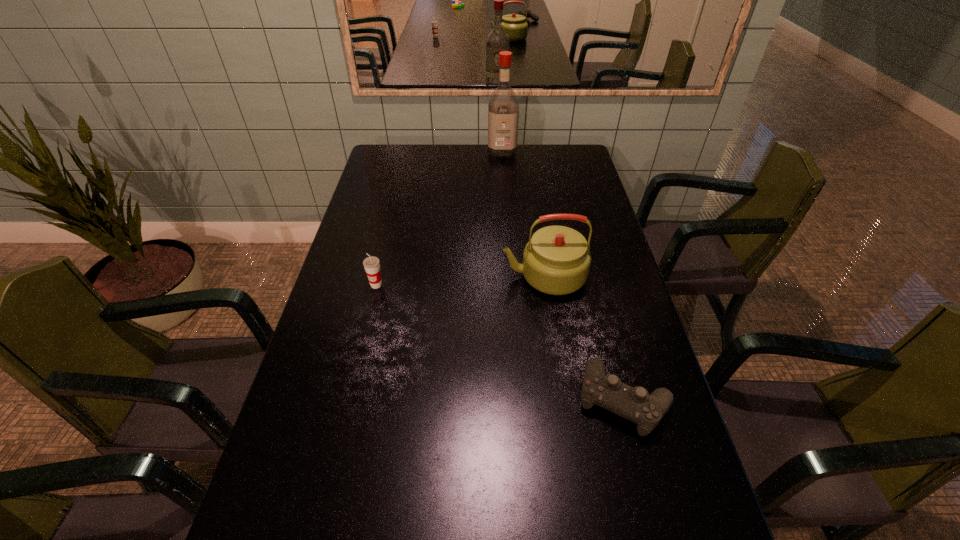
Identify the location of vacant space located 0.110m at the spout of the third shortest object. Image resolution: width=960 pixels, height=540 pixels. (467, 276).

This screenshot has height=540, width=960. Identify the location of vacant space located 0.270m on the side of the second shortest object with the logo. (357, 367).

This screenshot has height=540, width=960. Identify the location of free space located 0.180m on the left of the nearest object. (502, 400).

Find the location of `object that is at the far edge`. object that is at the far edge is located at coordinates (503, 105).

The height and width of the screenshot is (540, 960). What are the coordinates of `object present at the left edge` in the screenshot? It's located at (371, 264).

Identify the location of kettle that is at the right edge. pos(556,260).

Locate an element on the screen. The width and height of the screenshot is (960, 540). control positioned at the right edge is located at coordinates (635, 404).

I want to click on vacant space at the far edge of the desktop, so click(449, 152).

I want to click on vacant space at the left edge, so (324, 320).

In order to click on free region at the right edge of the desktop in this screenshot , I will do `click(601, 248)`.